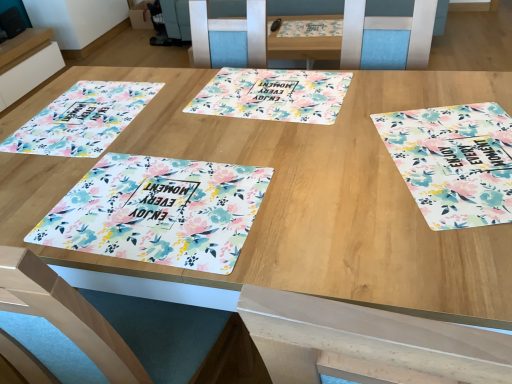
Question: Is floral fabric placemat at right, which is the third tablecloth in left-to-right order, aimed at floral printed placemat at left, arranged as the 3th tablecloth when viewed from the right?

Choices:
 (A) yes
 (B) no

Answer: (B)

Question: Is floral fabric placemat at right, which is the third tablecloth in left-to-right order, located outside floral printed placemat at left, arranged as the 3th tablecloth when viewed from the right?

Choices:
 (A) no
 (B) yes

Answer: (B)

Question: Can you confirm if floral fabric placemat at right, acting as the first tablecloth starting from the right, is positioned to the right of floral printed placemat at left, acting as the 1th tablecloth starting from the left?

Choices:
 (A) yes
 (B) no

Answer: (A)

Question: Can you confirm if floral fabric placemat at right, which is the third tablecloth in left-to-right order, is wider than floral printed placemat at left, arranged as the 3th tablecloth when viewed from the right?

Choices:
 (A) yes
 (B) no

Answer: (B)

Question: Is floral fabric placemat at right, acting as the first tablecloth starting from the right, beside floral printed placemat at left, acting as the 1th tablecloth starting from the left?

Choices:
 (A) no
 (B) yes

Answer: (A)

Question: In terms of width, does floral printed placemat at lower left, the 2th tablecloth when ordered from left to right, look wider or thinner when compared to floral printed placemat at left, acting as the 1th tablecloth starting from the left?

Choices:
 (A) wide
 (B) thin

Answer: (B)

Question: Is floral printed placemat at lower left, the second tablecloth when ordered from right to left, inside the boundaries of floral printed placemat at left, acting as the 1th tablecloth starting from the left, or outside?

Choices:
 (A) outside
 (B) inside

Answer: (A)

Question: Based on their positions, is floral printed placemat at lower left, the 2th tablecloth when ordered from left to right, located to the left or right of floral printed placemat at left, acting as the 1th tablecloth starting from the left?

Choices:
 (A) right
 (B) left

Answer: (A)

Question: Is point (34, 241) positioned closer to the camera than point (131, 104)?

Choices:
 (A) farther
 (B) closer

Answer: (B)

Question: In the image, is floral printed placemat at lower left, the second tablecloth when ordered from right to left, positioned in front of or behind white glossy placemat at upper left?

Choices:
 (A) front
 (B) behind

Answer: (A)

Question: In terms of size, does floral printed placemat at lower left, the 2th tablecloth when ordered from left to right, appear bigger or smaller than white glossy placemat at upper left?

Choices:
 (A) big
 (B) small

Answer: (B)

Question: From the image's perspective, is floral printed placemat at lower left, the second tablecloth when ordered from right to left, positioned above or below white glossy placemat at upper left?

Choices:
 (A) below
 (B) above

Answer: (A)

Question: Is point (249, 173) positioned closer to the camera than point (57, 57)?

Choices:
 (A) closer
 (B) farther

Answer: (A)

Question: Is floral fabric placemat at right, acting as the first tablecloth starting from the right, in front of or behind floral printed placemat at lower left, the 2th tablecloth when ordered from left to right, in the image?

Choices:
 (A) behind
 (B) front

Answer: (A)

Question: From the image's perspective, relative to floral printed placemat at lower left, the second tablecloth when ordered from right to left, is floral fabric placemat at right, acting as the first tablecloth starting from the right, above or below?

Choices:
 (A) above
 (B) below

Answer: (A)